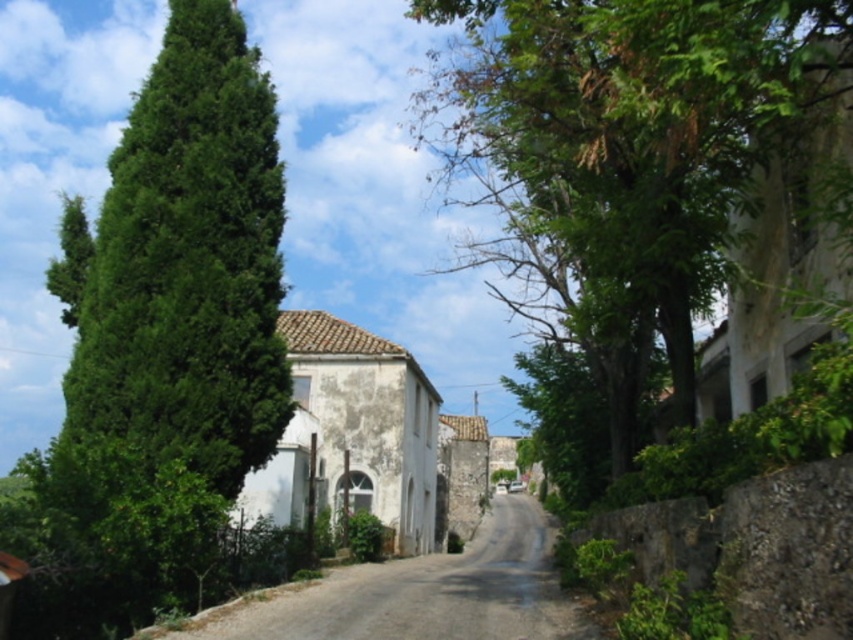
You are a painter setting up your easel on the narrow street. You want to capture the scene with both the green leafy tree at center and the smooth stone wall at left in your painting. Which object should you position closer to the edge of your canvas to ensure both fit properly?

Since the green leafy tree at center is wider than the smooth stone wall at left, you should position the green leafy tree at center closer to the edge of your canvas to ensure both fit properly.